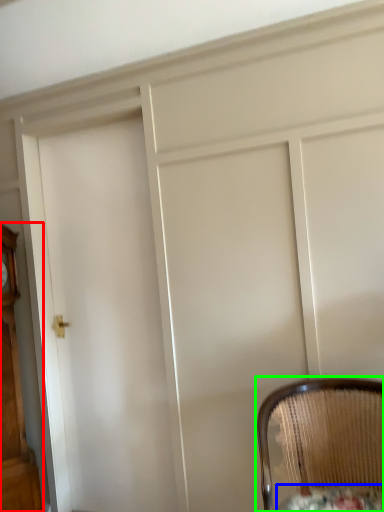
Question: Estimate the real-world distances between objects in this image. Which object is closer to furniture (highlighted by a red box), round table (highlighted by a blue box) or chair (highlighted by a green box)?

Choices:
 (A) round table
 (B) chair

Answer: (B)